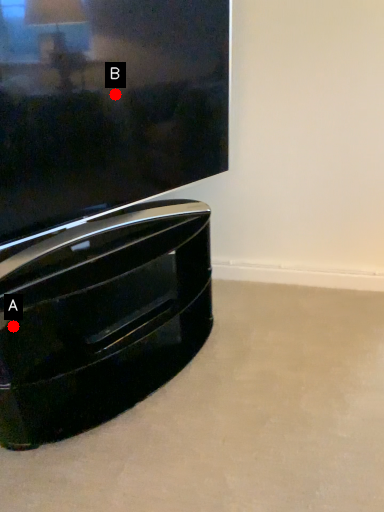
Question: Two points are circled on the image, labeled by A and B beside each circle. Among these points, which one is nearest to the camera?

Choices:
 (A) A is closer
 (B) B is closer

Answer: (B)